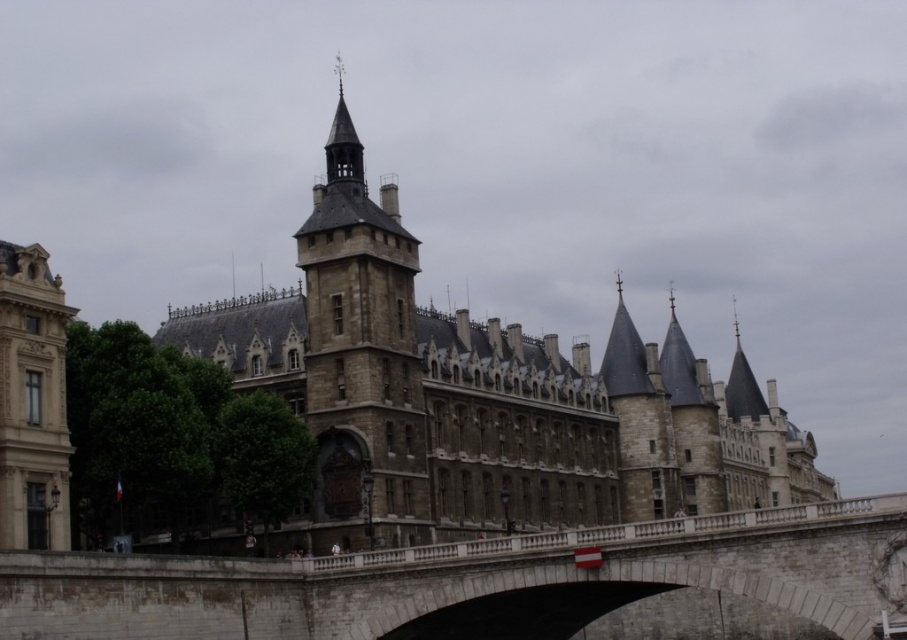
You are standing on the stone bridge at center and want to walk to the brown stone tower at center. Which direction should you head?

The stone bridge at center is to the right of brown stone tower at center, so you should head to the left to reach it.

Looking at this image, you are standing on the stone bridge at center and want to walk towards the stone tower at left. Is the tower directly above your current position?

Yes, the stone tower at left is directly above the stone bridge at center, so walking towards it would mean moving under the tower.